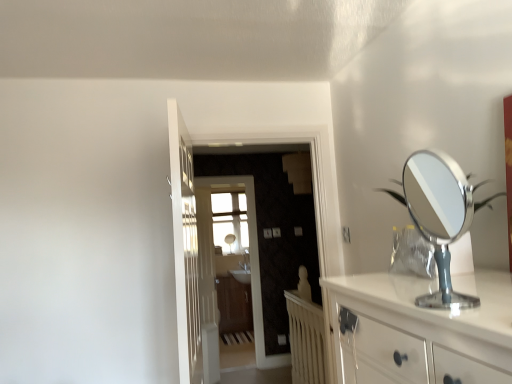
Question: From a real-world perspective, relative to matte wood screen door at center, the first screen door in the front-to-back sequence, is white glossy door at center, the second door positioned from the left, vertically above or below?

Choices:
 (A) below
 (B) above

Answer: (B)

Question: Looking at the image, does white glossy door at center, the second door positioned from the left, seem bigger or smaller compared to matte wood screen door at center, the first screen door in the front-to-back sequence?

Choices:
 (A) big
 (B) small

Answer: (A)

Question: Which object is the closest to the clear glass door at center, the second screen door positioned from the front?

Choices:
 (A) wooden cabinet at center
 (B) white wooden radiator at center
 (C) white glossy sink at center
 (D) silver/metallic round mirror at right
 (E) white wooden door at center, arranged as the 2th door when viewed from the right

Answer: (E)

Question: Which object is the closest to the matte wood screen door at center, the first screen door in the front-to-back sequence?

Choices:
 (A) white glossy sink at center
 (B) white wooden radiator at center
 (C) silver/metallic round mirror at right
 (D) white glossy door at center, placed as the first door when sorted from front to back
 (E) white wooden door at center, the second door in the front-to-back sequence

Answer: (B)